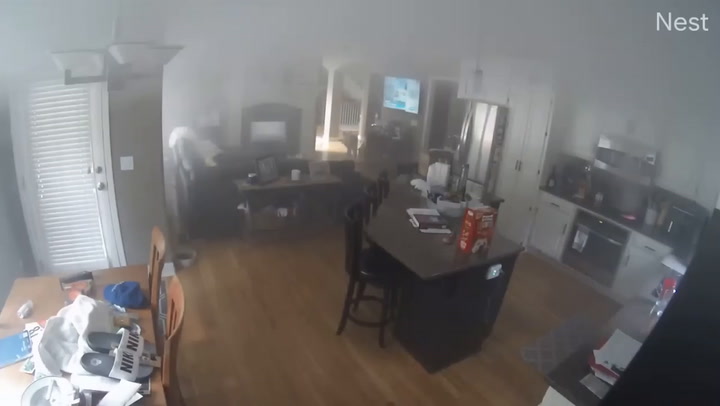
You are a GUI agent. You are given a task and a screenshot of the screen. Output one action in this format:
    pyautogui.click(x=<x>, y=<y>)
    Task: Click on the light switch
    This screenshot has width=720, height=406.
    Given the screenshot: What is the action you would take?
    pyautogui.click(x=121, y=188)